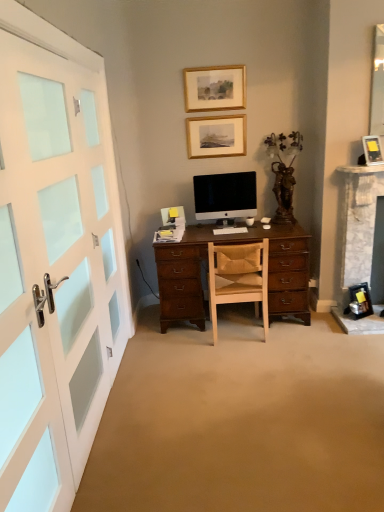
What are the coordinates of `empty space that is ontop of gold/glossy picture frame at upper center, arranged as the 3th picture frame when ordered from the bottom (from a real-world perspective)` in the screenshot? It's located at (220, 62).